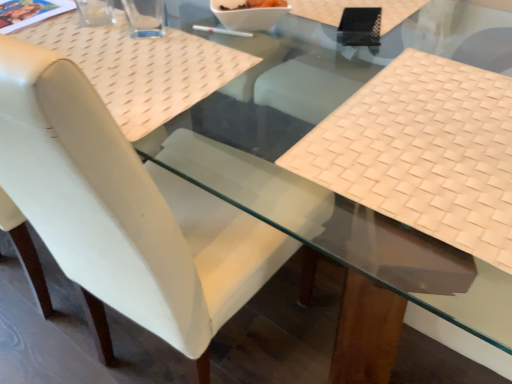
This screenshot has width=512, height=384. What are the coordinates of `free spot behind transparent glass at upper left, the first clear when ordered from right to left` in the screenshot? It's located at (146, 13).